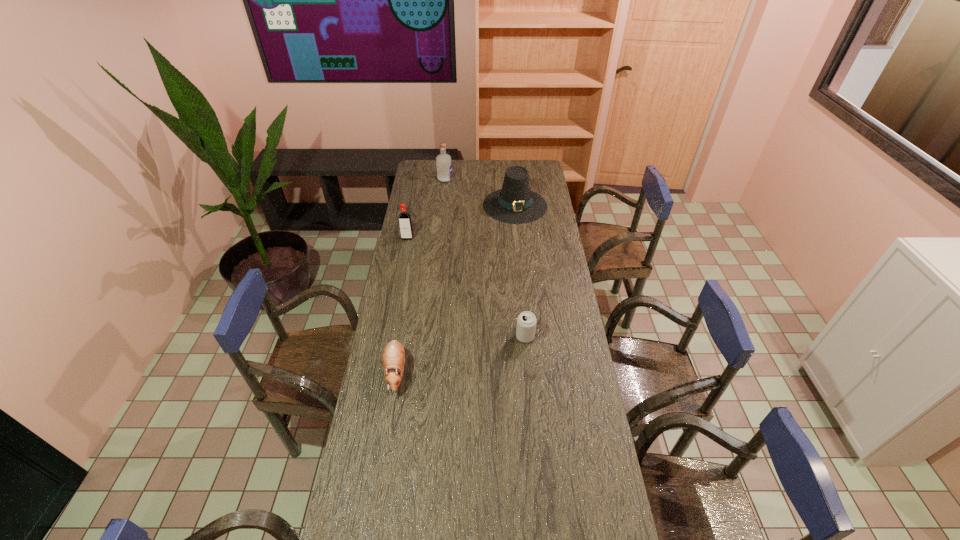
Where is `free spot that satisfies the following two spatial constraints: 1. on the front and back of the left vodka; 2. on the right side of the fourth farthest object`? The width and height of the screenshot is (960, 540). free spot that satisfies the following two spatial constraints: 1. on the front and back of the left vodka; 2. on the right side of the fourth farthest object is located at coordinates (389, 336).

The width and height of the screenshot is (960, 540). In order to click on free space that satisfies the following two spatial constraints: 1. on the label of the right vodka; 2. on the back side of the second nearest object in this screenshot , I will do `click(428, 336)`.

Locate an element on the screen. vacant area in the image that satisfies the following two spatial constraints: 1. on the front and back of the second nearest object; 2. on the left side of the left vodka is located at coordinates (389, 336).

This screenshot has width=960, height=540. I want to click on free space that satisfies the following two spatial constraints: 1. on the front and back of the third farthest object; 2. on the left side of the can, so click(389, 336).